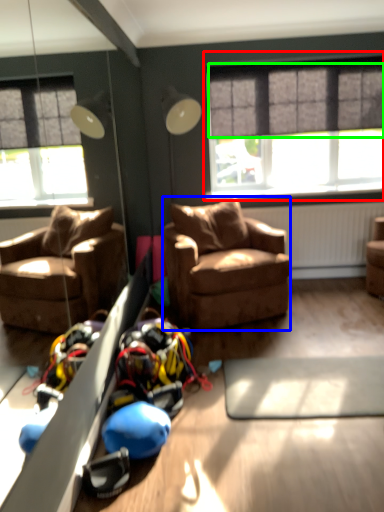
Question: Which object is positioned farthest from window (highlighted by a red box)? Select from studio couch (highlighted by a blue box) and curtain (highlighted by a green box).

Choices:
 (A) studio couch
 (B) curtain

Answer: (A)